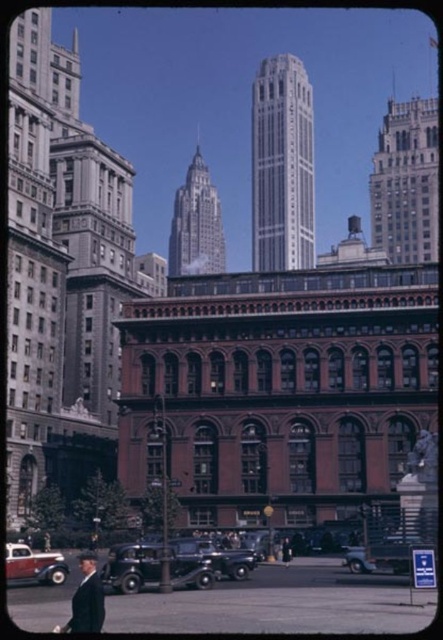
Question: Can you confirm if gray stone skyscraper at upper right is smaller than shiny black car at lower center?

Choices:
 (A) no
 (B) yes

Answer: (A)

Question: Which of the following is the farthest from the observer?

Choices:
 (A) shiny black car at lower center
 (B) white marble skyscraper at center

Answer: (B)

Question: Estimate the real-world distances between objects in this image. Which object is closer to the gray stone skyscraper at upper right?

Choices:
 (A) matte red car at lower left
 (B) shiny black car at center

Answer: (A)

Question: Is silver metallic skyscraper at center wider than shiny black car at lower center?

Choices:
 (A) no
 (B) yes

Answer: (B)

Question: Which point is closer to the camera?

Choices:
 (A) shiny black car at lower center
 (B) silver metallic skyscraper at center
 (C) white marble skyscraper at center
 (D) dark gray suit at lower left

Answer: (D)

Question: Is gray stone skyscraper at upper right to the right of matte red car at lower left from the viewer's perspective?

Choices:
 (A) no
 (B) yes

Answer: (B)